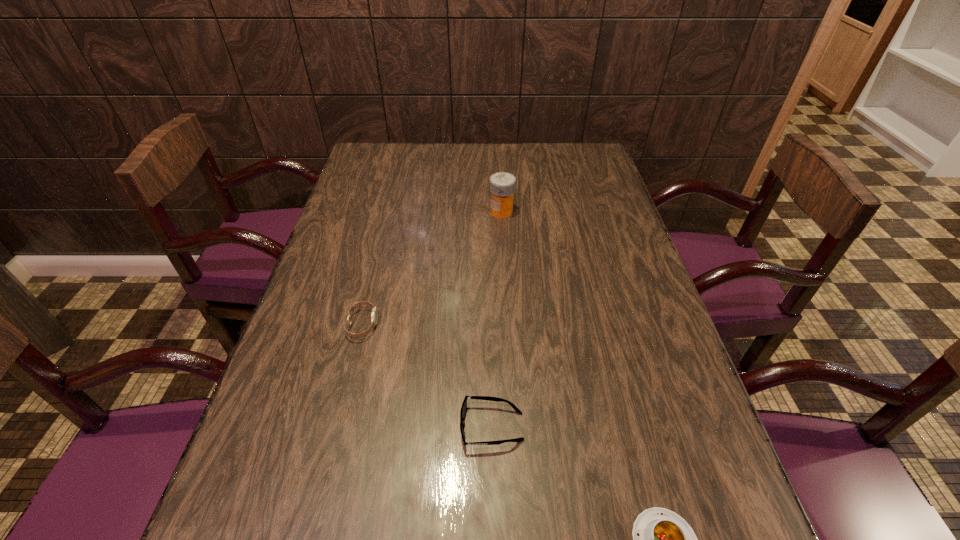
I want to click on vacant space located 0.060m on the front-facing side of the second nearest object, so click(429, 427).

In order to click on free point located on the front-facing side of the second nearest object in this screenshot , I will do `click(345, 427)`.

What are the coordinates of `vacant space located 0.060m on the front-facing side of the second nearest object` in the screenshot? It's located at (429, 427).

You are a GUI agent. You are given a task and a screenshot of the screen. Output one action in this format:
    pyautogui.click(x=<x>, y=<y>)
    Task: Click on the object situated at the left edge
    
    Given the screenshot: What is the action you would take?
    pyautogui.click(x=374, y=315)

The width and height of the screenshot is (960, 540). In the image, there is a desktop. Identify the location of free space at the far edge. (514, 167).

In the image, there is a desktop. Where is `free space at the left edge`? The width and height of the screenshot is (960, 540). free space at the left edge is located at coordinates (264, 460).

What are the coordinates of `vacant area at the right edge of the desktop` in the screenshot? It's located at (612, 241).

Identify the location of free space at the far left corner of the desktop. (384, 167).

In order to click on vacant point located between the leftmost object and the sunglasses in this screenshot , I will do `click(427, 376)`.

What are the coordinates of `vacant area that lies between the shortest object and the farthest object` in the screenshot? It's located at (496, 319).